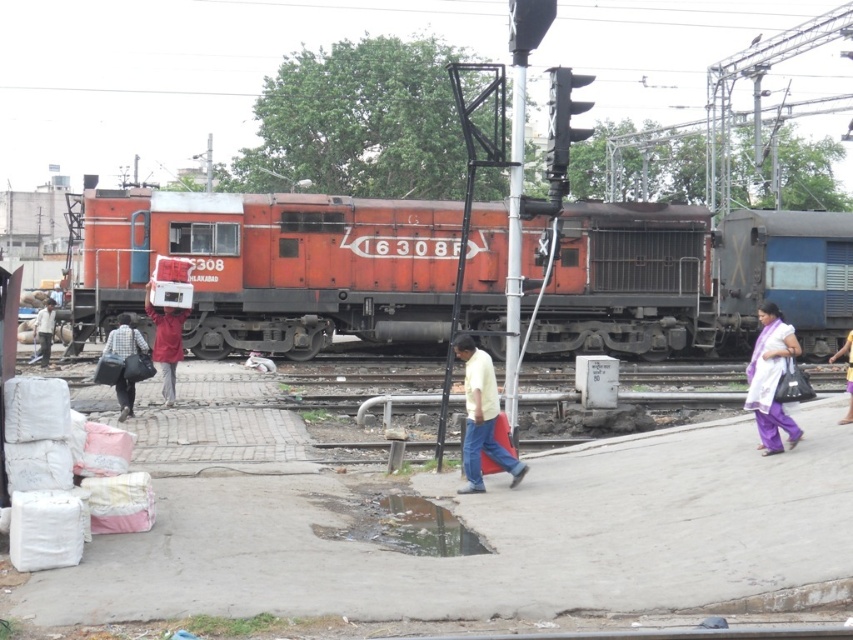
You are a photographer standing at the railway station. You want to take a photo of the matte orange train at center and the light pink fabric at center. Based on their positions, which object would appear larger in the photo?

The matte orange train at center would appear larger in the photo because it is wider than the light pink fabric at center.

You are standing at the railway station and want to take a photo. You notice two points in the scene labeled as point (x=125, y=404) and point (x=848, y=340). Which point should you focus on first if you want to capture the closest object to the camera in your photo?

Point (x=125, y=404) is closer to the camera than point (x=848, y=340), so you should focus on point (x=125, y=404) first to capture the closest object.